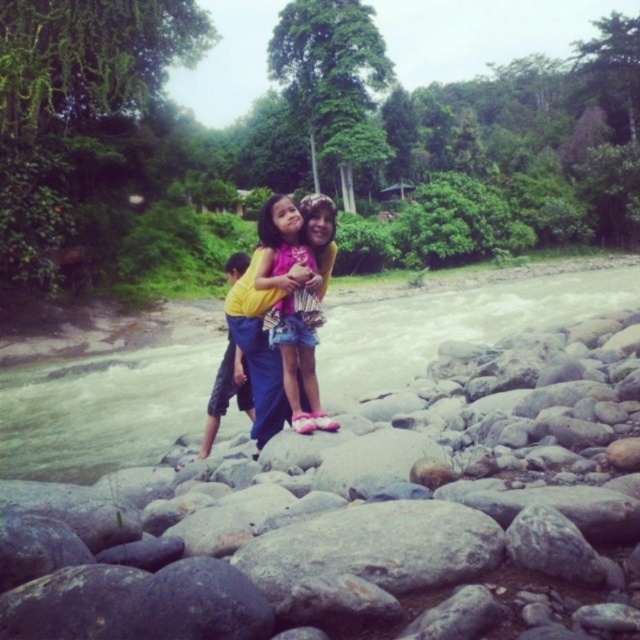
Question: Which point is farther from the camera taking this photo?

Choices:
 (A) (228, 396)
 (B) (278, 244)
 (C) (211, 355)

Answer: (C)

Question: Observing the image, what is the correct spatial positioning of smooth gray rock at center in reference to pink fabric dress at center?

Choices:
 (A) below
 (B) above

Answer: (A)

Question: Which point is farther to the camera?

Choices:
 (A) clear water at stream center
 (B) smooth gray rock at center
 (C) yellow fabric pants at center

Answer: (A)

Question: Is smooth gray rock at center above clear water at stream center?

Choices:
 (A) yes
 (B) no

Answer: (B)

Question: From the image, what is the correct spatial relationship of clear water at stream center in relation to yellow fabric pants at center?

Choices:
 (A) left
 (B) right

Answer: (B)

Question: Which of the following is the farthest from the observer?

Choices:
 (A) (232, 362)
 (B) (336, 531)
 (C) (524, 312)
 (D) (330, 220)

Answer: (C)